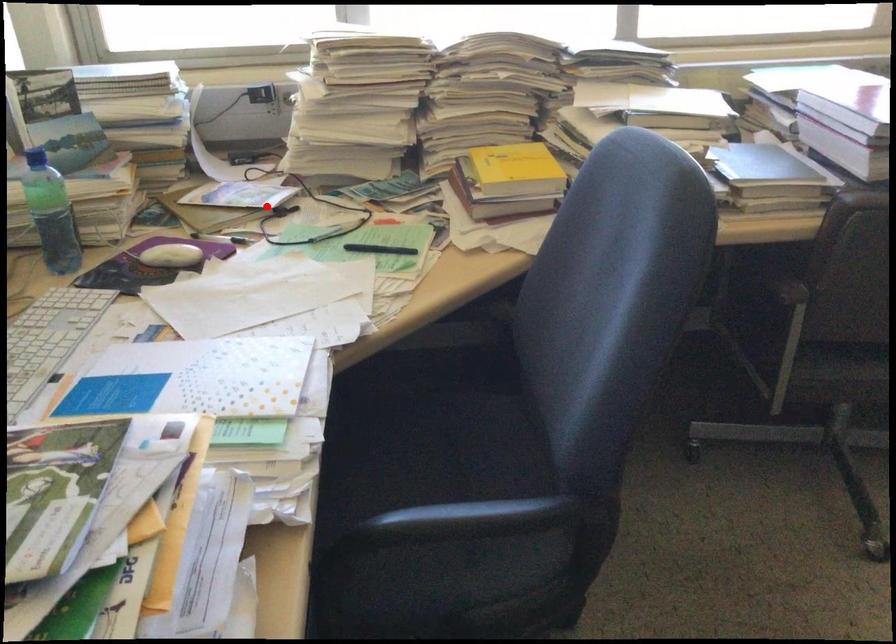
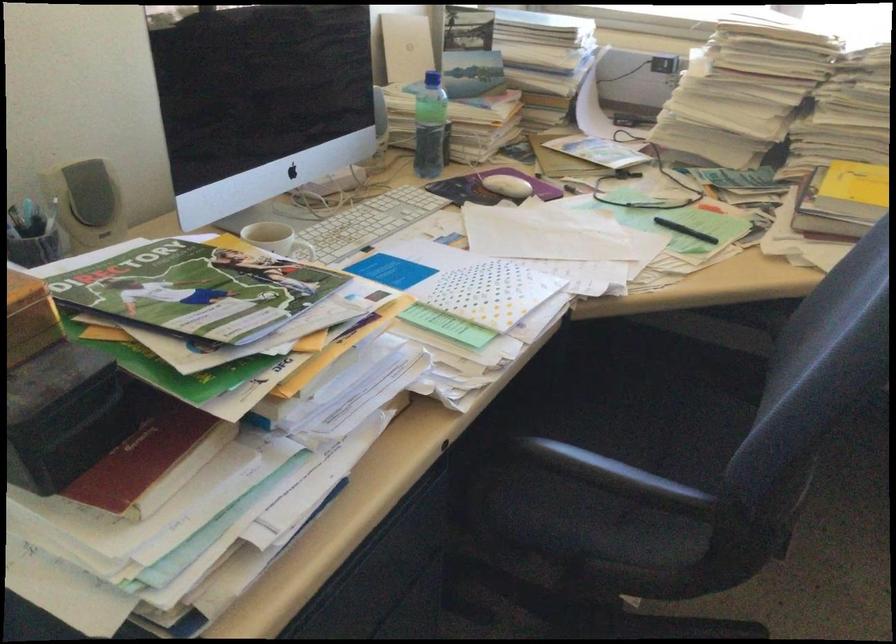
Locate, in the second image, the point that corresponds to the highlighted location in the first image.

(610, 166)